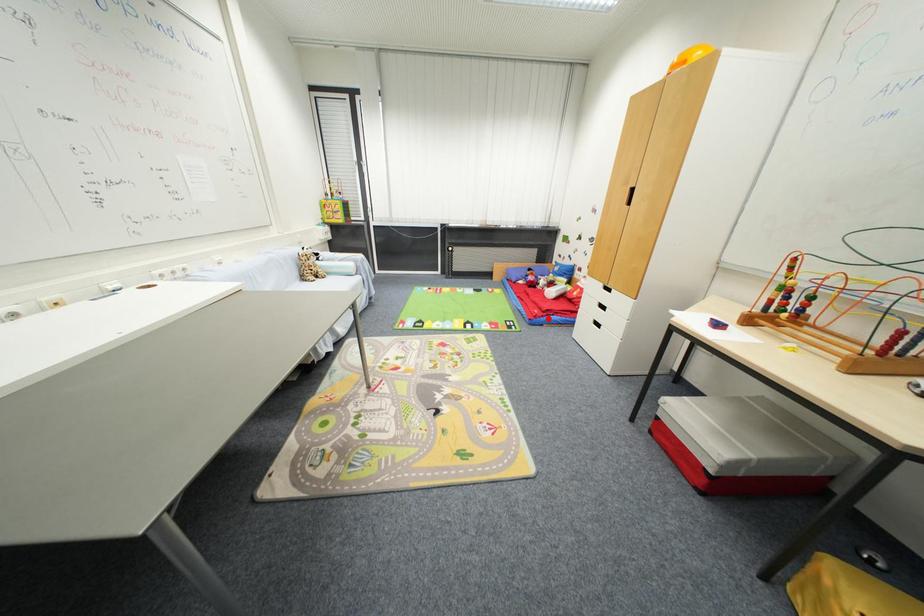
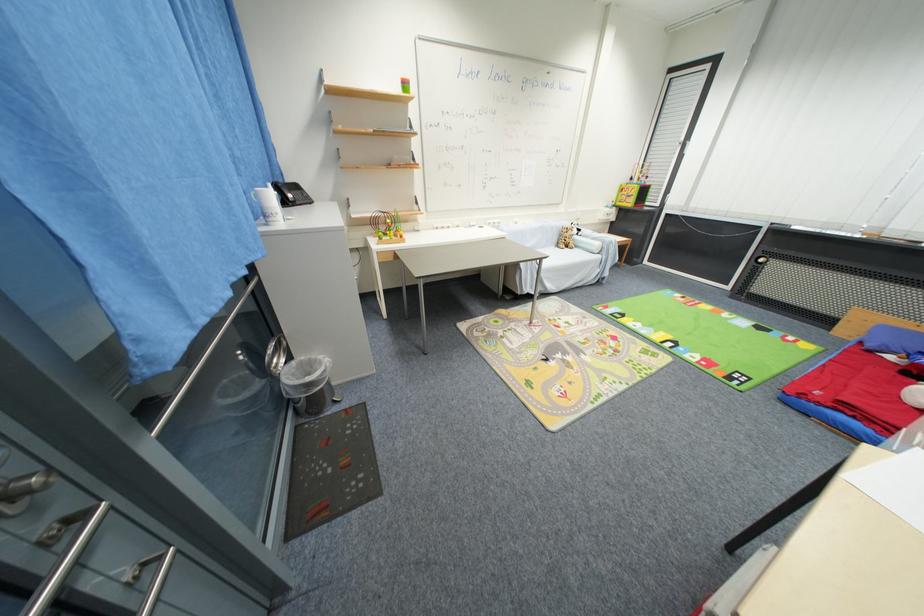
Question: I am providing you with two images of the same scene from different viewpoints. In image1, a red point is highlighted. Considering the same 3D point in image2, which of the following is correct?

Choices:
 (A) It is closer
 (B) It is farther

Answer: (B)